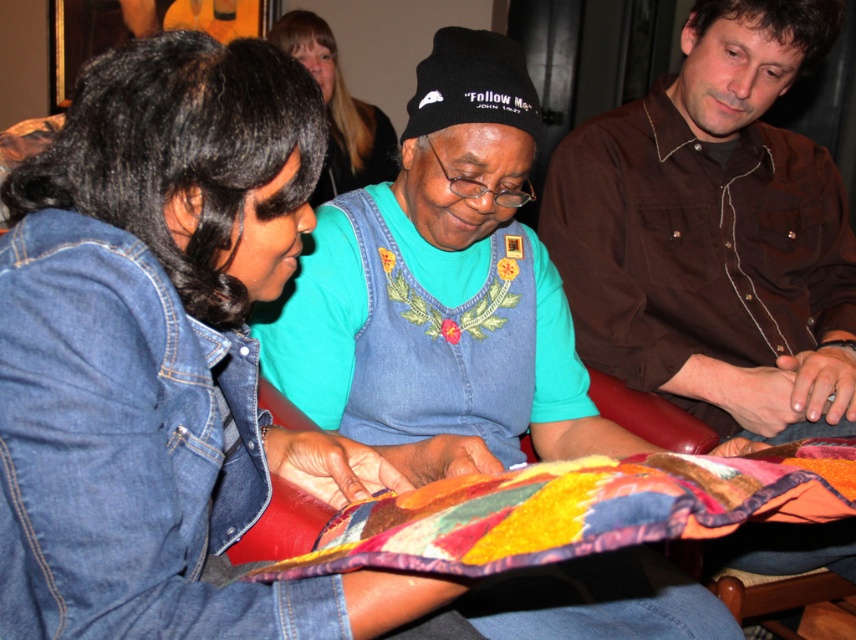
Is brushed denim jacket at lower left to the right of denim jacket at center from the viewer's perspective?

Indeed, brushed denim jacket at lower left is positioned on the right side of denim jacket at center.

Is point (200, 150) closer to camera compared to point (321, 58)?

Yes.

At what (x,y) coordinates should I click in order to perform the action: click on brushed denim jacket at lower left. Please return your answer as a coordinate pair (x, y). Image resolution: width=856 pixels, height=640 pixels. Looking at the image, I should click on tap(164, 356).

Which is more to the left, brushed denim jacket at lower left or brown textured shirt at center right?

brushed denim jacket at lower left

Can you confirm if brushed denim jacket at lower left is positioned below brown textured shirt at center right?

Yes.

The width and height of the screenshot is (856, 640). What do you see at coordinates (164, 356) in the screenshot? I see `brushed denim jacket at lower left` at bounding box center [164, 356].

This screenshot has height=640, width=856. What are the coordinates of `brushed denim jacket at lower left` in the screenshot? It's located at (164, 356).

Who is higher up, brown textured shirt at center right or denim jacket at center?

denim jacket at center

Does brown textured shirt at center right have a smaller size compared to denim jacket at center?

Incorrect, brown textured shirt at center right is not smaller in size than denim jacket at center.

Is point (651, 193) behind point (330, 189)?

No, it is in front of (330, 189).

Locate an element on the screen. brown textured shirt at center right is located at coordinates (715, 232).